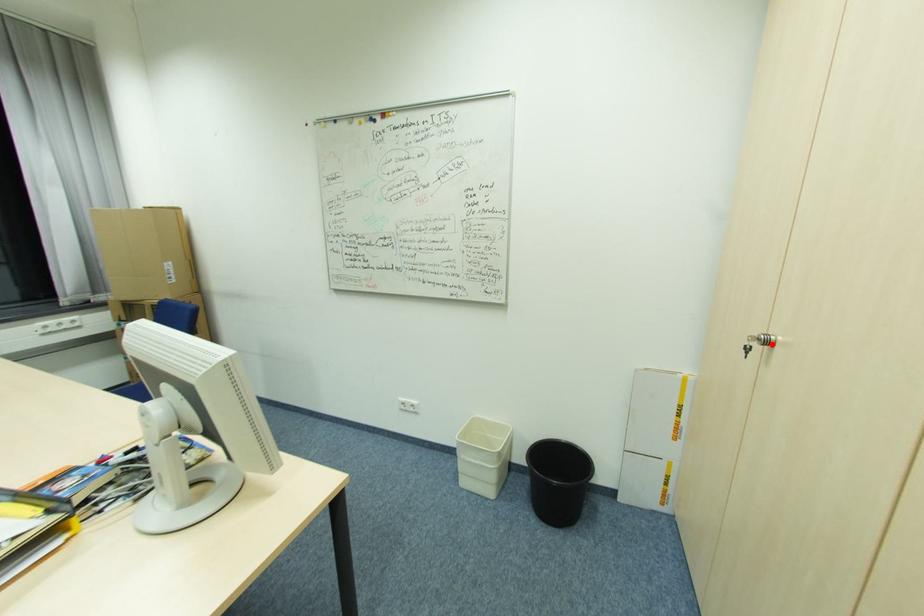
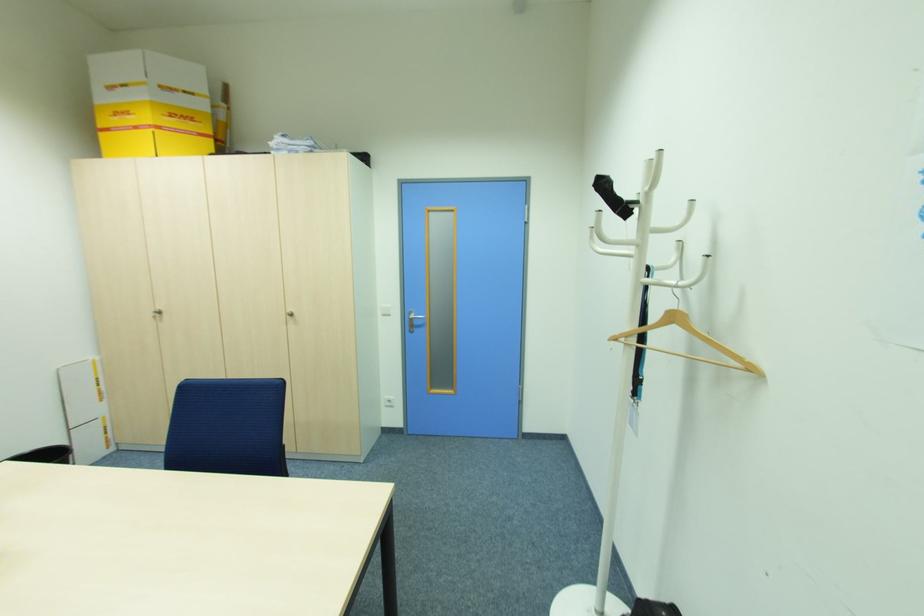
The point at the highlighted location is marked in the first image. Where is the corresponding point in the second image?

(162, 312)